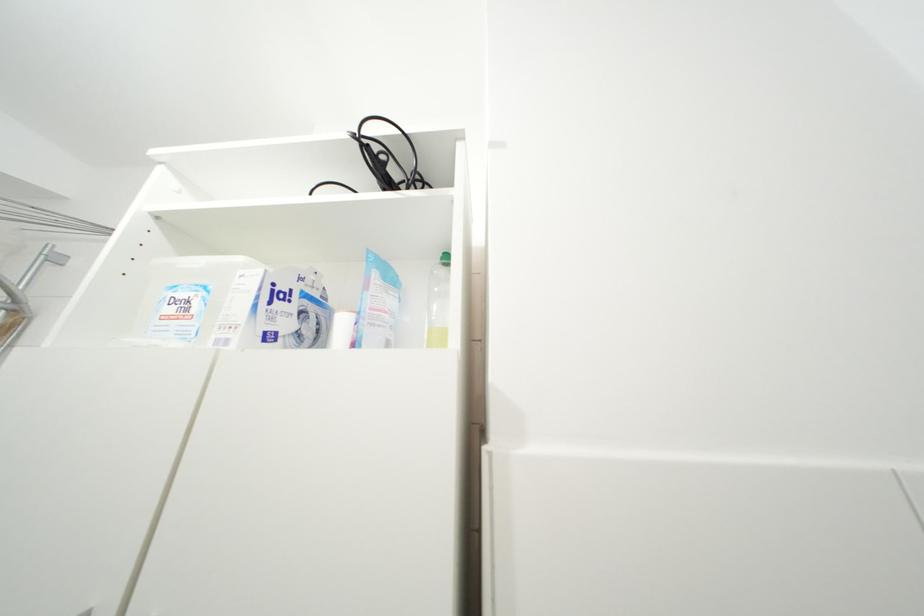
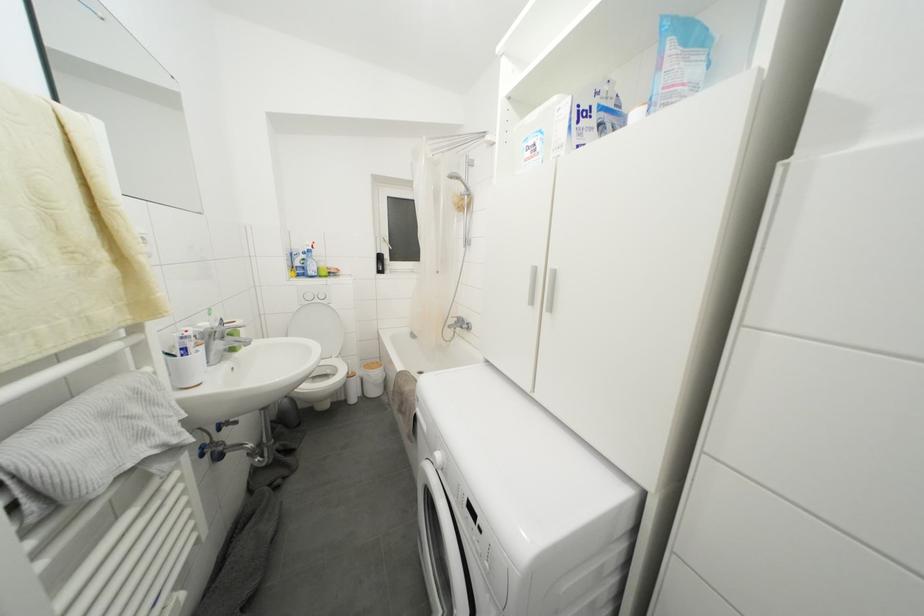
Locate, in the second image, the point that corresponds to the point at 191,315 in the first image.

(540, 155)